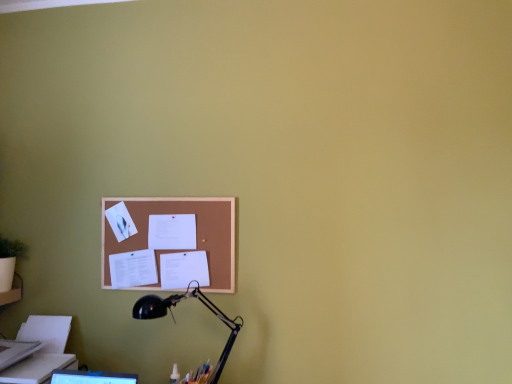
Question: Is corkboard at center not near white paper at center?

Choices:
 (A) no
 (B) yes

Answer: (A)

Question: Is corkboard at center completely or partially outside of white paper at center?

Choices:
 (A) yes
 (B) no

Answer: (A)

Question: Considering the relative sizes of corkboard at center and white paper at center in the image provided, is corkboard at center wider than white paper at center?

Choices:
 (A) no
 (B) yes

Answer: (A)

Question: From the image's perspective, would you say corkboard at center is shown under white paper at center?

Choices:
 (A) no
 (B) yes

Answer: (B)

Question: Is corkboard at center smaller than white paper at center?

Choices:
 (A) yes
 (B) no

Answer: (B)

Question: Is white paper at center to the left or to the right of white paper at lower left in the image?

Choices:
 (A) left
 (B) right

Answer: (B)

Question: From a real-world perspective, is white paper at center positioned above or below white paper at lower left?

Choices:
 (A) below
 (B) above

Answer: (B)

Question: Relative to white paper at lower left, is white paper at center in front or behind?

Choices:
 (A) behind
 (B) front

Answer: (A)

Question: Considering the positions of point click(151, 230) and point click(7, 370), is point click(151, 230) closer or farther from the camera than point click(7, 370)?

Choices:
 (A) farther
 (B) closer

Answer: (A)

Question: Based on their positions, is white paper at lower left located to the left or right of corkboard at center?

Choices:
 (A) right
 (B) left

Answer: (B)

Question: In the image, is white paper at lower left positioned in front of or behind corkboard at center?

Choices:
 (A) front
 (B) behind

Answer: (A)

Question: Considering the positions of white paper at lower left and corkboard at center in the image, is white paper at lower left taller or shorter than corkboard at center?

Choices:
 (A) tall
 (B) short

Answer: (B)

Question: From a real-world perspective, is white paper at lower left above or below corkboard at center?

Choices:
 (A) below
 (B) above

Answer: (A)

Question: In the image, is white paper at lower left on the left side or the right side of white paper at center?

Choices:
 (A) left
 (B) right

Answer: (A)

Question: Based on their sizes in the image, would you say white paper at lower left is bigger or smaller than white paper at center?

Choices:
 (A) big
 (B) small

Answer: (A)